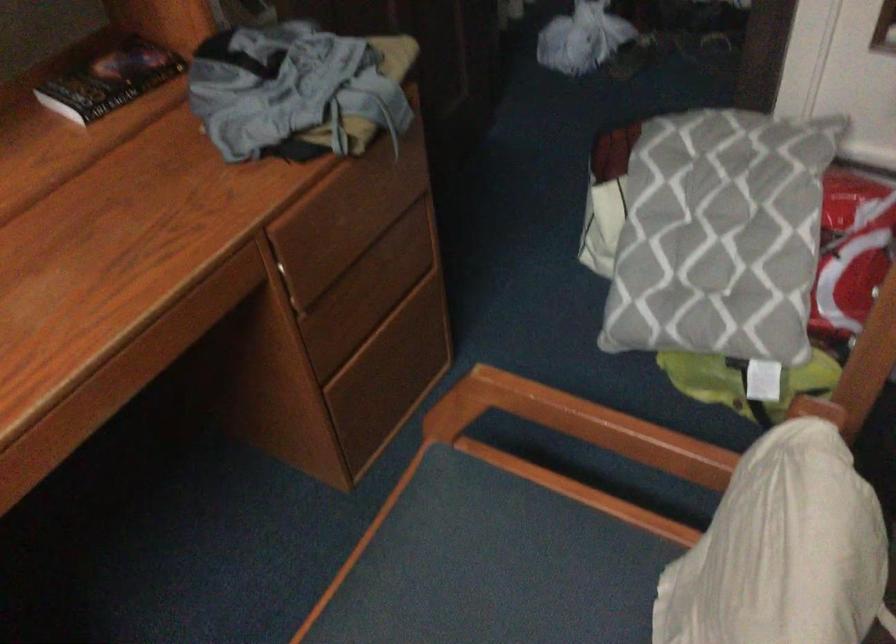
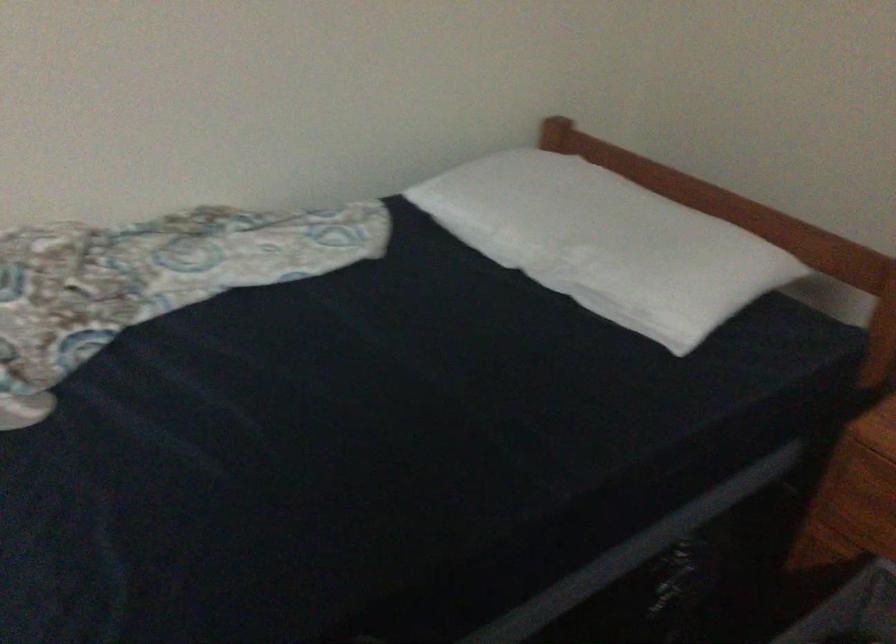
Question: Based on the continuous images, in which direction is the camera rotating? Reply with the corresponding letter.

Choices:
 (A) Left
 (B) Right
 (C) Up
 (D) Down

Answer: (B)